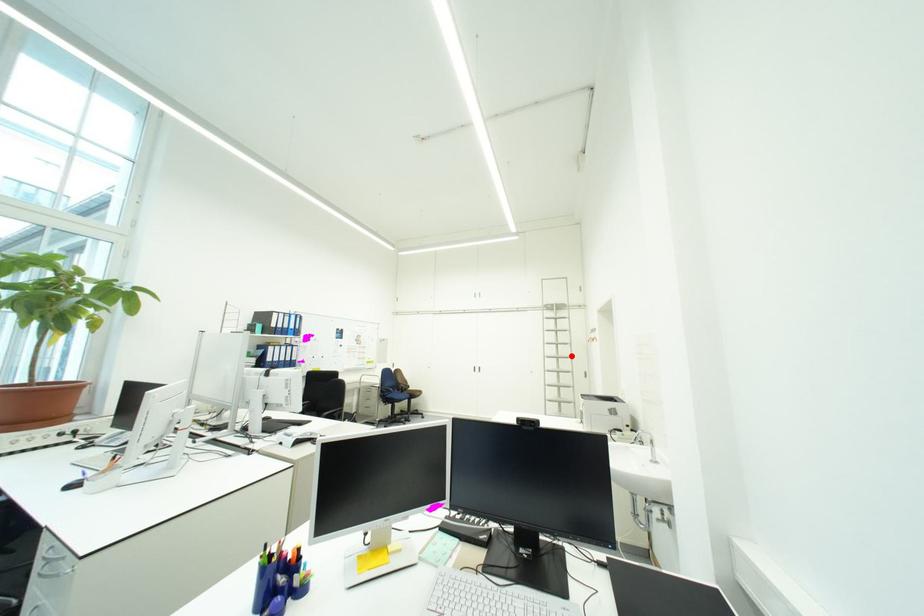
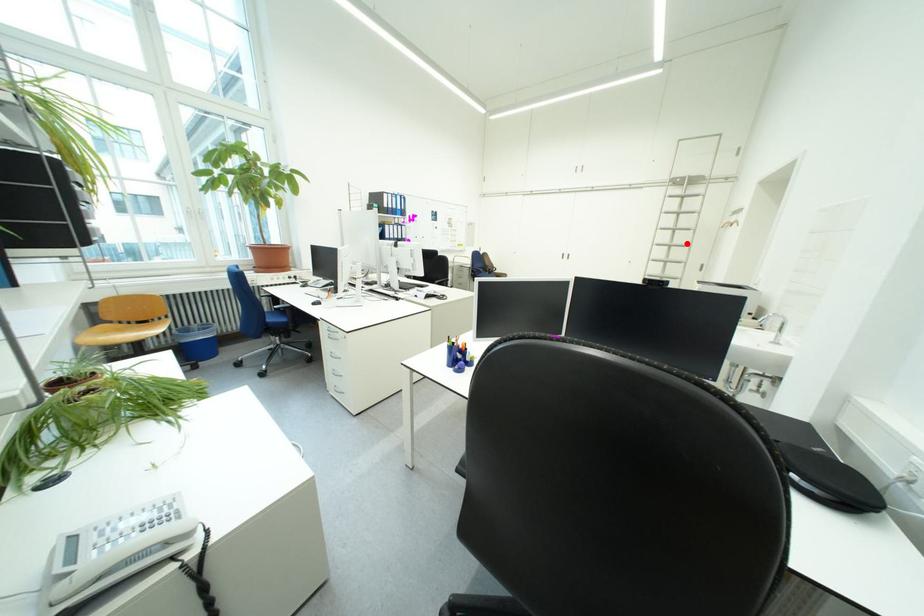
I am providing you with two images of the same scene from different viewpoints. A red point is marked on the first image and another point is marked on the second image. Are the points marked in image1 and image2 representing the same 3D position?

Yes